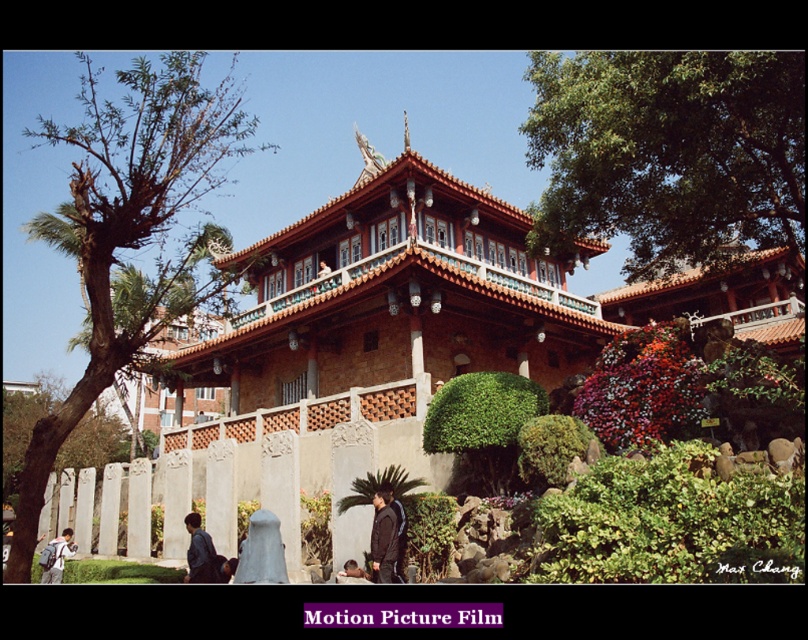
You are standing in front of the temple and want to take a photo that includes both the point at coordinates point (381, 512) and point (200, 554). Which point should you focus on to ensure both are in sharp focus?

You should focus on point (381, 512) because it is closer to the camera, ensuring both points will be in focus when using the hyperfocal distance technique.

You are a visitor standing in front of the temple, and you see the brown leafy tree at left and the dark brown leather jacket at center. Which object is wider?

The brown leafy tree at left is wider than the dark brown leather jacket at center.